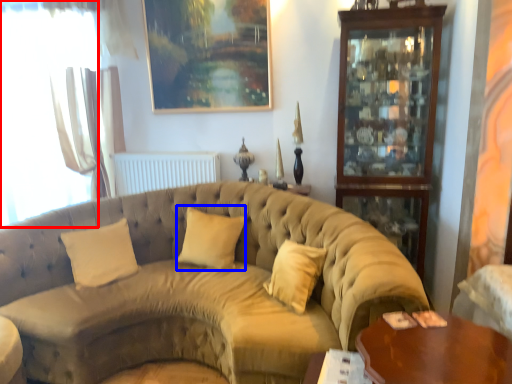
Question: Among these objects, which one is farthest to the camera, window (highlighted by a red box) or pillow (highlighted by a blue box)?

Choices:
 (A) window
 (B) pillow

Answer: (A)